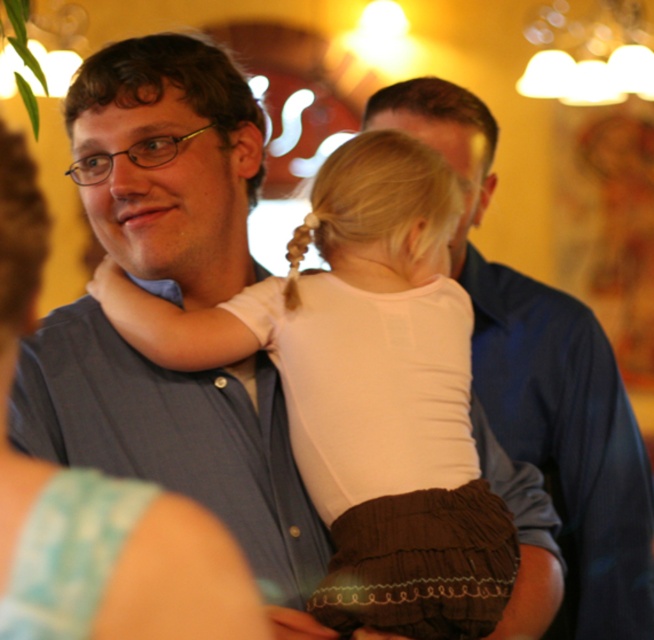
Does white cotton shirt at center lie behind white fabric at left?

That is False.

How far apart are white cotton shirt at center and white fabric at left?

white cotton shirt at center and white fabric at left are 8.16 inches apart from each other.

The height and width of the screenshot is (640, 654). What do you see at coordinates (356, 369) in the screenshot?
I see `white cotton shirt at center` at bounding box center [356, 369].

This screenshot has width=654, height=640. In order to click on white cotton shirt at center in this screenshot , I will do `click(356, 369)`.